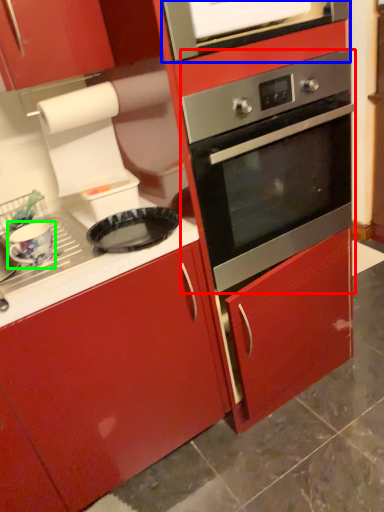
Question: Which object is the farthest from oven (highlighted by a red box)? Choose among these: vent (highlighted by a blue box) or appliance (highlighted by a green box).

Choices:
 (A) vent
 (B) appliance

Answer: (B)